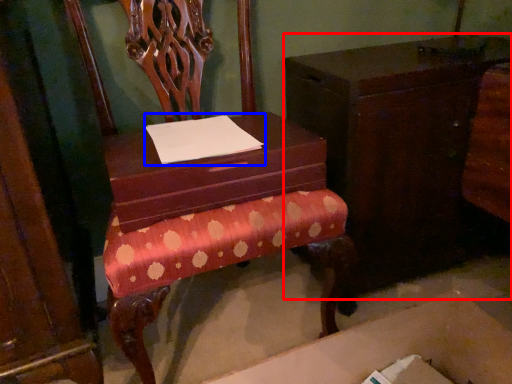
Question: Which of the following is the closest to the observer, furniture (highlighted by a red box) or notepad (highlighted by a blue box)?

Choices:
 (A) furniture
 (B) notepad

Answer: (B)